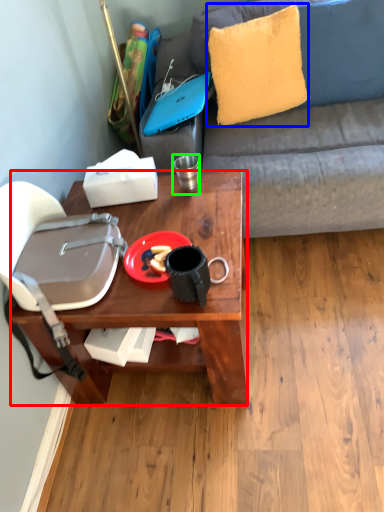
Question: Considering the real-world distances, which object is closest to desk (highlighted by a red box)? pillow (highlighted by a blue box) or coffee cup (highlighted by a green box).

Choices:
 (A) pillow
 (B) coffee cup

Answer: (B)